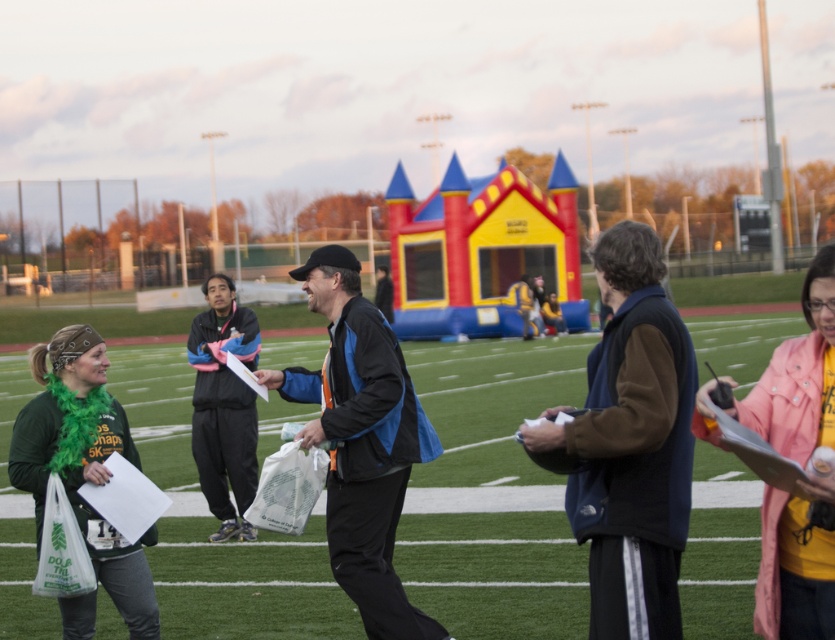
Can you confirm if green artificial turf at center is positioned to the left of pink fabric jacket at lower right?

Indeed, green artificial turf at center is positioned on the left side of pink fabric jacket at lower right.

Is green artificial turf at center wider than pink fabric jacket at lower right?

Indeed, green artificial turf at center has a greater width compared to pink fabric jacket at lower right.

Is point (251, 547) positioned before point (752, 417)?

No, (251, 547) is further to viewer.

Locate an element on the screen. The height and width of the screenshot is (640, 835). green artificial turf at center is located at coordinates (492, 492).